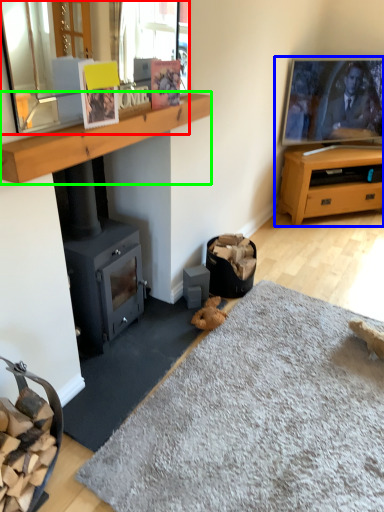
Question: Which object is positioned farthest from mirror (highlighted by a red box)? Select from entertainment center (highlighted by a blue box) and mantle (highlighted by a green box).

Choices:
 (A) entertainment center
 (B) mantle

Answer: (A)